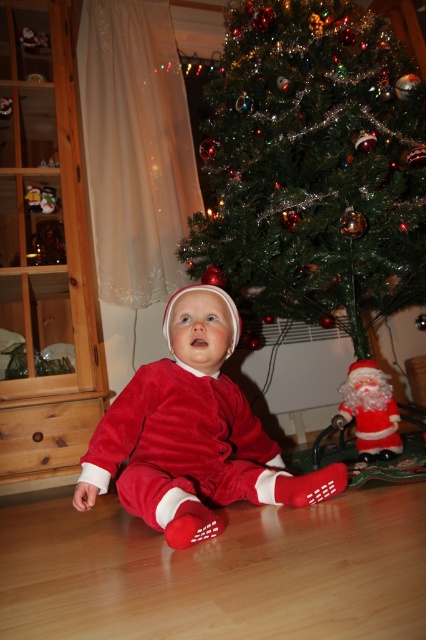
Question: Can you confirm if green shiny christmas tree at center is thinner than velvet red santa suit at center?

Choices:
 (A) no
 (B) yes

Answer: (A)

Question: Which point is farther to the camera?

Choices:
 (A) velvet red santa suit at center
 (B) green shiny christmas tree at center

Answer: (B)

Question: Does green shiny christmas tree at center have a greater width compared to velvet red santa suit at center?

Choices:
 (A) no
 (B) yes

Answer: (B)

Question: Where is green shiny christmas tree at center located in relation to velvet red santa suit at center in the image?

Choices:
 (A) left
 (B) right

Answer: (B)